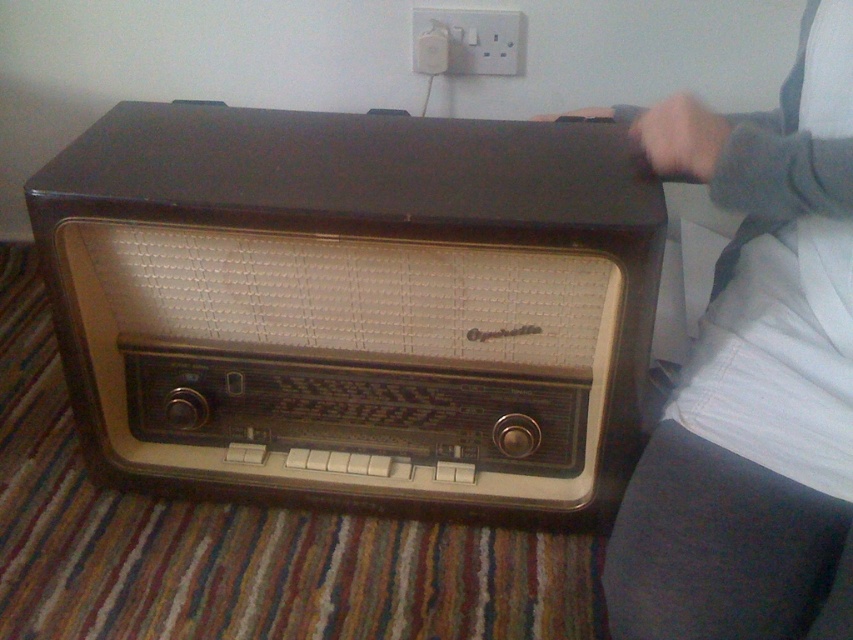
Question: Does matte black radio at center come in front of gray fabric at upper right?

Choices:
 (A) yes
 (B) no

Answer: (B)

Question: Is matte black radio at center above gray fabric at upper right?

Choices:
 (A) no
 (B) yes

Answer: (B)

Question: Can you confirm if matte black radio at center is smaller than gray fabric at upper right?

Choices:
 (A) yes
 (B) no

Answer: (B)

Question: Which of the following is the closest to the observer?

Choices:
 (A) (503, 381)
 (B) (730, 355)

Answer: (B)

Question: Which of the following is the closest to the observer?

Choices:
 (A) matte black radio at center
 (B) gray fabric at upper right

Answer: (B)